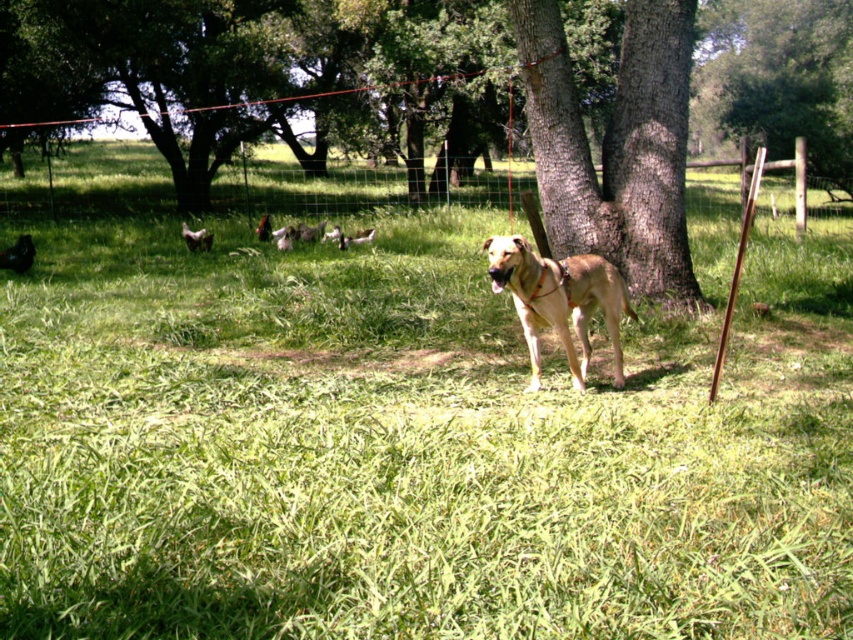
You are standing at point (618, 304) and want to walk to the point (839, 212). Is the destination point behind you or in front of you?

The destination point (839, 212) is behind point (618, 304), so if you are standing at point (618, 304), the destination point is behind you.

You are a farmer who wants to check the chickens in the fenced area. You see the wire mesh fence at center and the light brown fur at center. Which object is wider?

The wire mesh fence at center is wider than the light brown fur at center.

You are a farmer who wants to place a scarecrow between the brown rough bark tree at center and the wire mesh fence at center. Based on their positions, which object should the scarecrow be closer to?

The scarecrow should be placed closer to the wire mesh fence at center because the brown rough bark tree at center is to the right of the wire mesh fence at center.